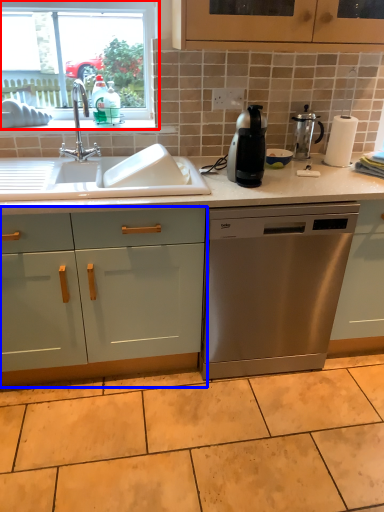
Question: Which point is further to the camera, window (highlighted by a red box) or cabinetry (highlighted by a blue box)?

Choices:
 (A) window
 (B) cabinetry

Answer: (A)